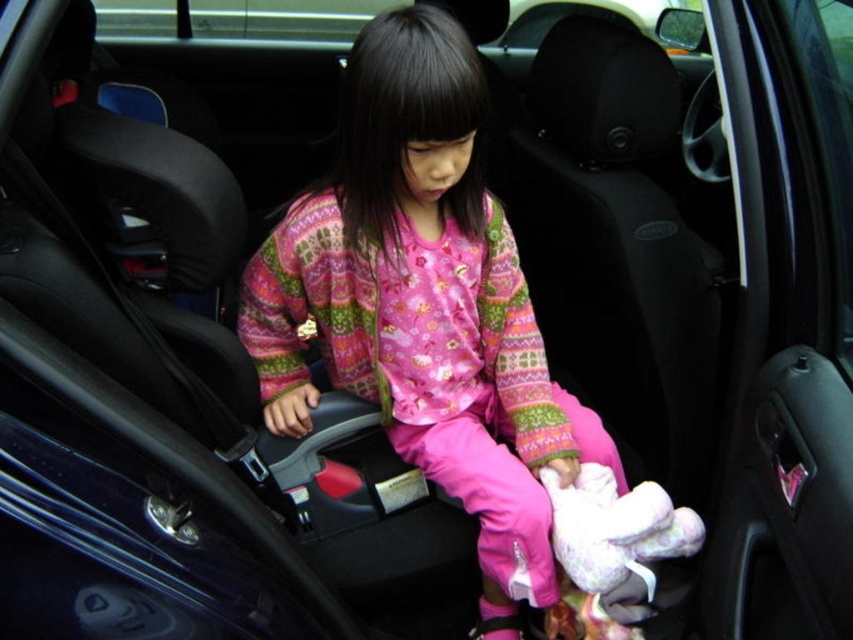
Which is below, pink fabric pajamas at center or white plush toy at center?

white plush toy at center

Is point (450, 170) farther from viewer compared to point (616, 500)?

That is False.

Between point (483, 97) and point (587, 483), which one is positioned in front?

Point (483, 97) is more forward.

This screenshot has width=853, height=640. What are the coordinates of `pink fabric pajamas at center` in the screenshot? It's located at (424, 305).